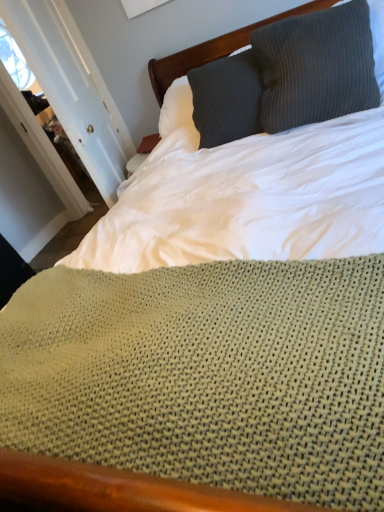
Question: Would you say knitted gray pillow at upper right is to the left or to the right of white painted wood door at upper left in the picture?

Choices:
 (A) right
 (B) left

Answer: (A)

Question: Considering the positions of knitted gray pillow at upper right and white painted wood door at upper left in the image, is knitted gray pillow at upper right wider or thinner than white painted wood door at upper left?

Choices:
 (A) thin
 (B) wide

Answer: (B)

Question: Does point (360, 54) appear closer or farther from the camera than point (87, 57)?

Choices:
 (A) farther
 (B) closer

Answer: (B)

Question: Considering their positions, is white painted wood door at upper left located in front of or behind knitted gray pillow at upper right?

Choices:
 (A) front
 (B) behind

Answer: (B)

Question: Is white painted wood door at upper left wider or thinner than knitted gray pillow at upper right?

Choices:
 (A) wide
 (B) thin

Answer: (B)

Question: Considering the positions of point (46, 68) and point (362, 29), is point (46, 68) closer or farther from the camera than point (362, 29)?

Choices:
 (A) closer
 (B) farther

Answer: (B)

Question: From a real-world perspective, relative to knitted gray pillow at upper right, is white painted wood door at upper left vertically above or below?

Choices:
 (A) above
 (B) below

Answer: (A)